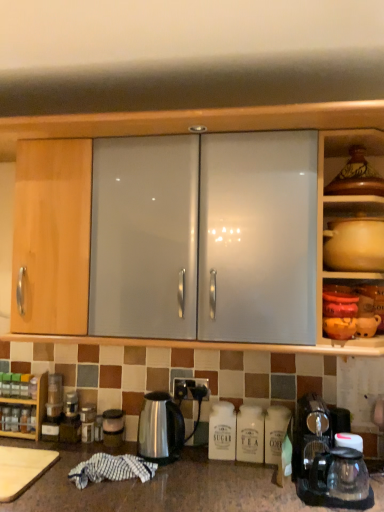
Question: Is satin black socket at center facing away from matte brown pot at upper right?

Choices:
 (A) yes
 (B) no

Answer: (B)

Question: Considering the relative sizes of satin black socket at center and matte brown pot at upper right in the image provided, is satin black socket at center wider than matte brown pot at upper right?

Choices:
 (A) yes
 (B) no

Answer: (B)

Question: Would you say satin black socket at center is a long distance from matte brown pot at upper right?

Choices:
 (A) no
 (B) yes

Answer: (A)

Question: Is satin black socket at center bigger than matte brown pot at upper right?

Choices:
 (A) yes
 (B) no

Answer: (B)

Question: Is satin black socket at center positioned behind matte brown pot at upper right?

Choices:
 (A) yes
 (B) no

Answer: (A)

Question: From a real-world perspective, is satin black socket at center physically below matte brown pot at upper right?

Choices:
 (A) no
 (B) yes

Answer: (B)

Question: Is satin silver kettle at center surrounding satin black socket at center?

Choices:
 (A) no
 (B) yes

Answer: (A)

Question: Is satin silver kettle at center smaller than satin black socket at center?

Choices:
 (A) no
 (B) yes

Answer: (A)

Question: Does satin silver kettle at center appear on the left side of satin black socket at center?

Choices:
 (A) no
 (B) yes

Answer: (B)

Question: Does satin silver kettle at center turn towards satin black socket at center?

Choices:
 (A) yes
 (B) no

Answer: (B)

Question: Can you confirm if satin silver kettle at center is thinner than satin black socket at center?

Choices:
 (A) no
 (B) yes

Answer: (A)

Question: Is the position of satin silver kettle at center less distant than that of satin black socket at center?

Choices:
 (A) no
 (B) yes

Answer: (B)

Question: Are wooden spice rack at lower left, the 2th cabinetry from the top, and satin silver canister at lower center, placed as the first appliance when sorted from right to left, far apart?

Choices:
 (A) no
 (B) yes

Answer: (A)